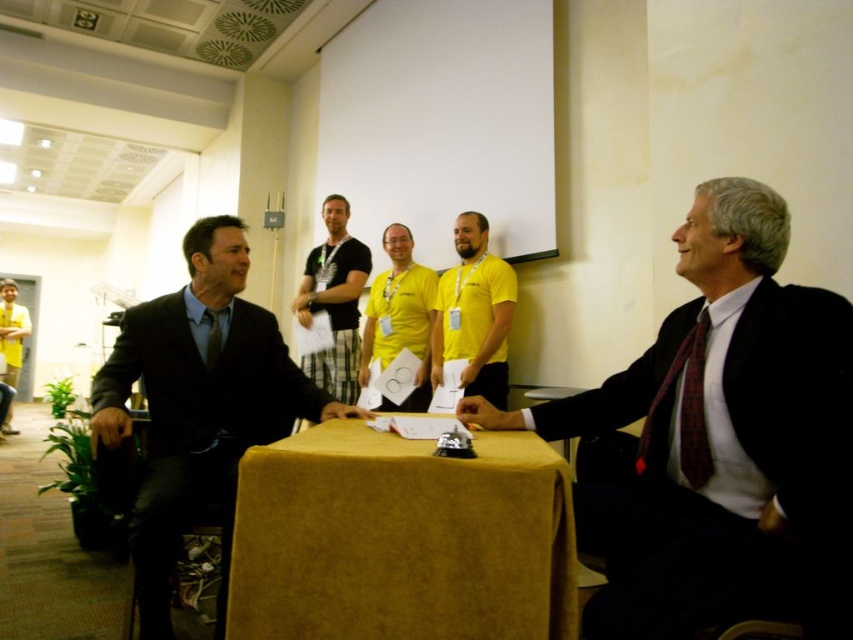
You are organizing a charity event and need to decide which of the two items, the black suit at left or the yellow fabric shirt at center, can be used to cover a larger object. Based on their sizes, which one would you choose?

The black suit at left is bigger than the yellow fabric shirt at center, so it can cover a larger object.